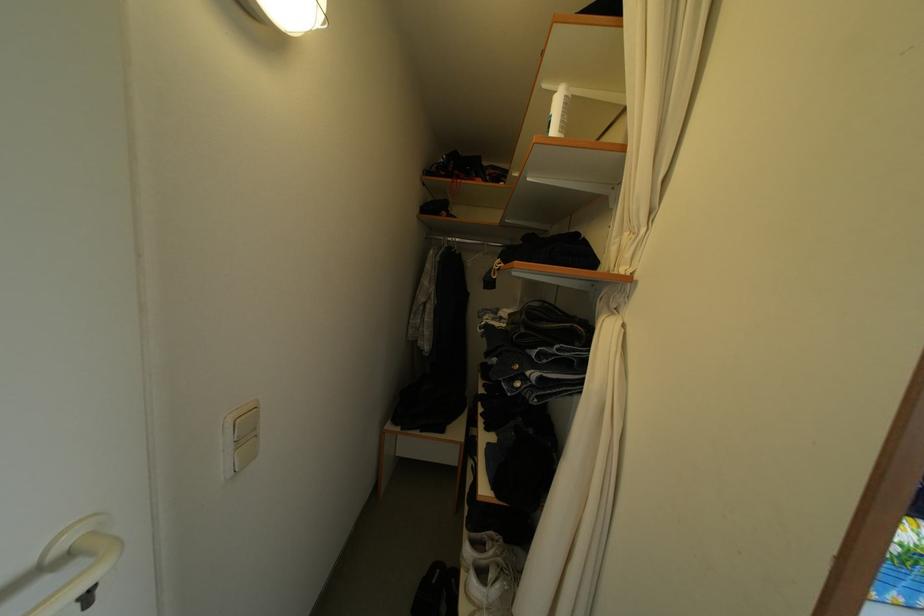
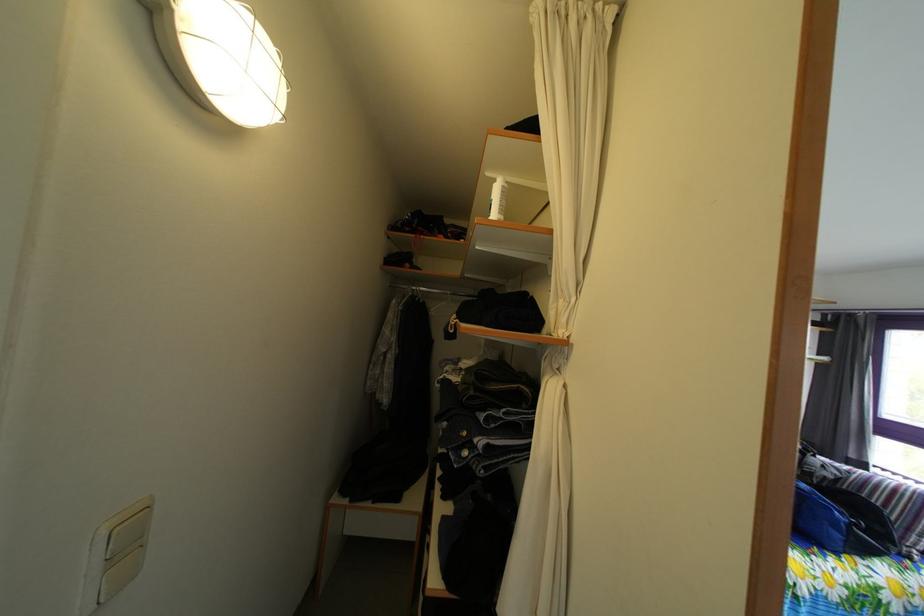
What movement of the cameraman would produce the second image?

The cameraman moved toward right, backward.